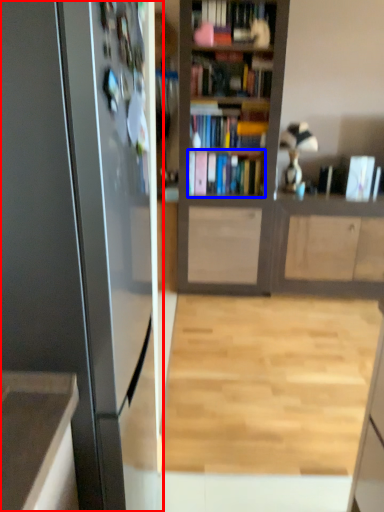
Question: Which point is further to the camera, appliance (highlighted by a red box) or book (highlighted by a blue box)?

Choices:
 (A) appliance
 (B) book

Answer: (B)